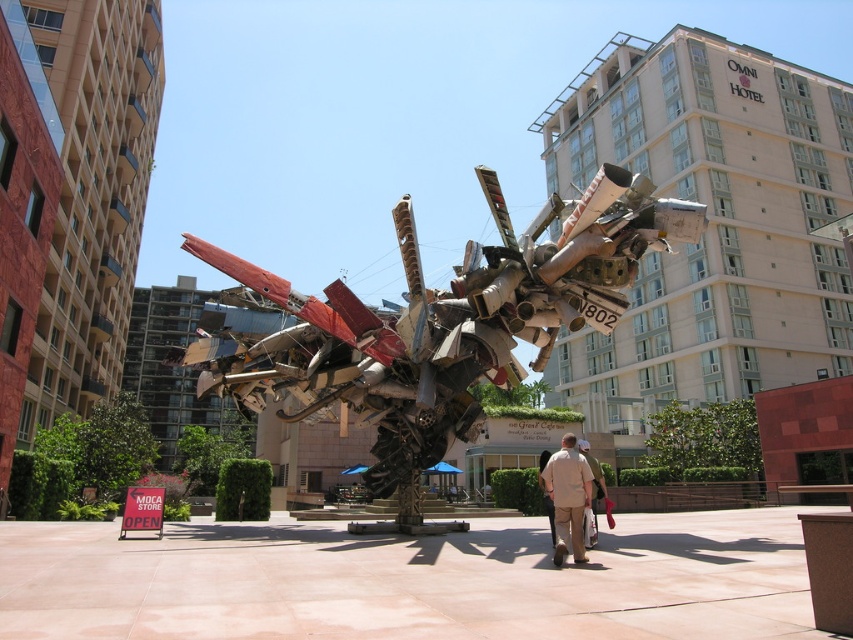
Question: Which point is closer to the camera?

Choices:
 (A) (566, 445)
 (B) (595, 522)

Answer: (A)

Question: Is tan fabric shirt at center to the right of beige fabric pants at center from the viewer's perspective?

Choices:
 (A) no
 (B) yes

Answer: (A)

Question: Which of the following is the closest to the observer?

Choices:
 (A) beige fabric pants at center
 (B) tan fabric shirt at center

Answer: (B)

Question: Observing the image, what is the correct spatial positioning of tan fabric shirt at center in reference to beige fabric pants at center?

Choices:
 (A) below
 (B) above

Answer: (B)

Question: Which of the following is the closest to the observer?

Choices:
 (A) tan fabric shirt at center
 (B) beige fabric pants at center

Answer: (A)

Question: Is tan fabric shirt at center positioned at the back of beige fabric pants at center?

Choices:
 (A) no
 (B) yes

Answer: (A)